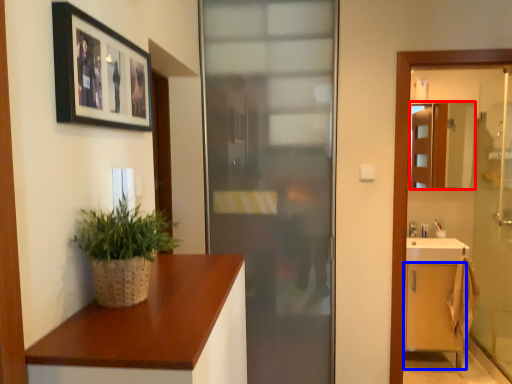
Question: Which object appears farthest to the camera in this image, mirror (highlighted by a red box) or cabinetry (highlighted by a blue box)?

Choices:
 (A) mirror
 (B) cabinetry

Answer: (A)